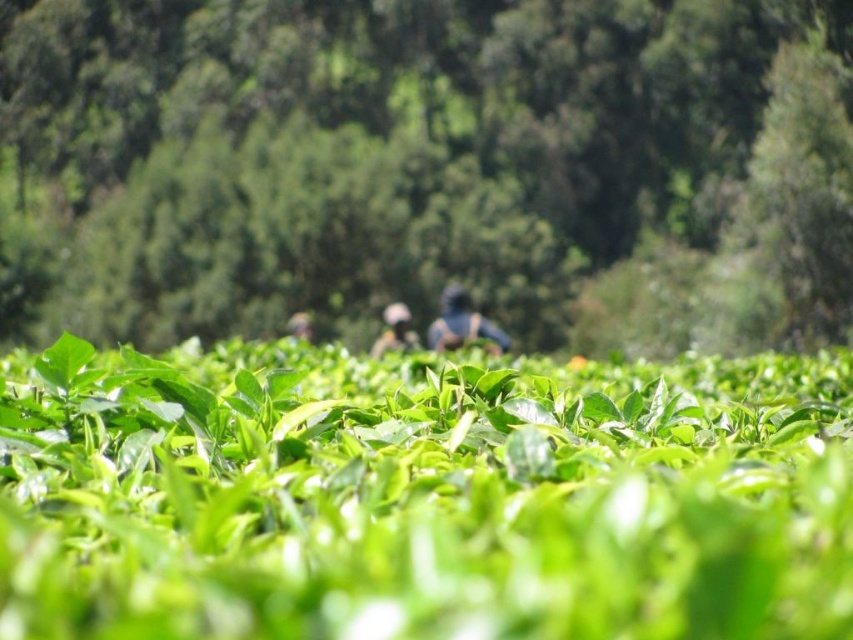
You are standing in the tea plantation and notice two green leafy plants. One is labeled as the green leafy plant at center and the other as the green leafy field at center. Which one is positioned to the left?

The green leafy plant at center is to the left of the green leafy field at center.

From the picture: You are a photographer standing in the tea plantation. You notice the blue fabric at center and the matte blue shirt at center. Which object appears narrower when viewed from your current position?

The blue fabric at center has a lesser width compared to matte blue shirt at center, so it appears narrower.

You are standing at the point labeled as point (428, 168) in the tea plantation. What is the closest object to you?

The closest object to you at point (428, 168) is the green leafy plant at center.